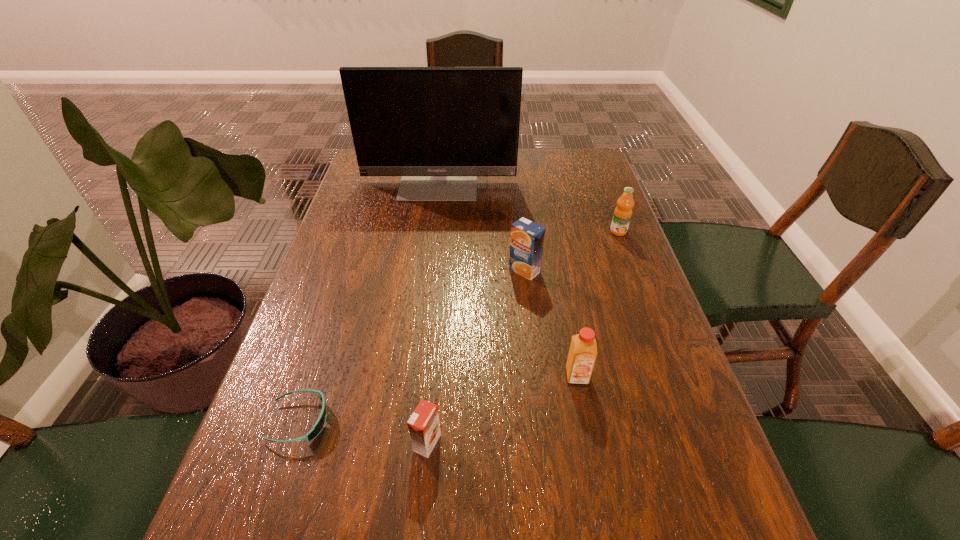
Image resolution: width=960 pixels, height=540 pixels. What are the coordinates of `free space in the image that satisfies the following two spatial constraints: 1. on the back side of the nearest orange juice; 2. on the front-facing side of the sunglasses` in the screenshot? It's located at (429, 421).

Find the location of `free space in the image that satisfies the following two spatial constraints: 1. on the front side of the third orange juice from right to left; 2. on the front-facing side of the shortest object`. free space in the image that satisfies the following two spatial constraints: 1. on the front side of the third orange juice from right to left; 2. on the front-facing side of the shortest object is located at coordinates (541, 421).

Where is `free space that satisfies the following two spatial constraints: 1. on the front-facing side of the nearest orange juice; 2. on the left side of the sunglasses`? This screenshot has height=540, width=960. free space that satisfies the following two spatial constraints: 1. on the front-facing side of the nearest orange juice; 2. on the left side of the sunglasses is located at coordinates (292, 443).

This screenshot has width=960, height=540. I want to click on free space that satisfies the following two spatial constraints: 1. on the screen of the farthest object; 2. on the left side of the second orange juice from left to right, so click(x=427, y=271).